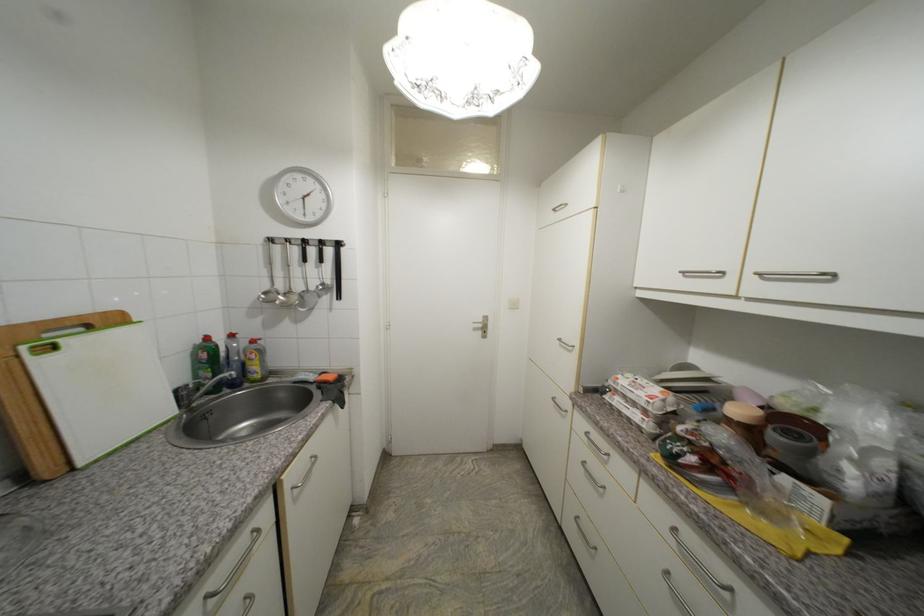
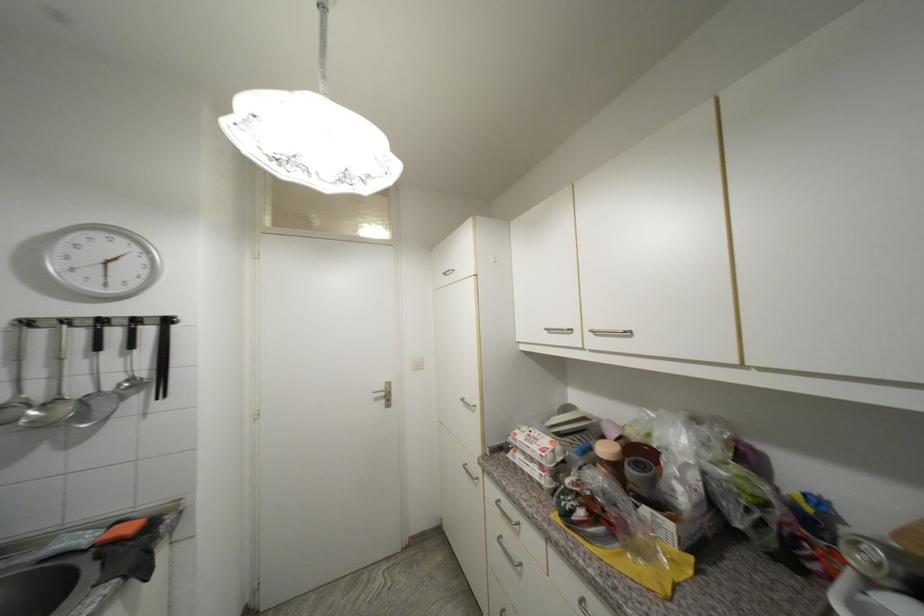
Locate, in the second image, the point that corresponds to (487,322) in the first image.

(388, 390)